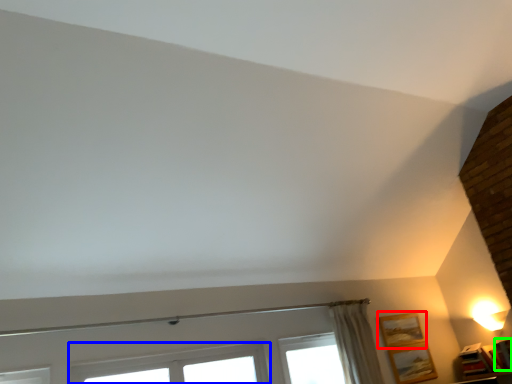
Question: Which is nearer to the picture frame (highlighted by a red box)? window (highlighted by a blue box) or picture frame (highlighted by a green box).

Choices:
 (A) window
 (B) picture frame

Answer: (B)